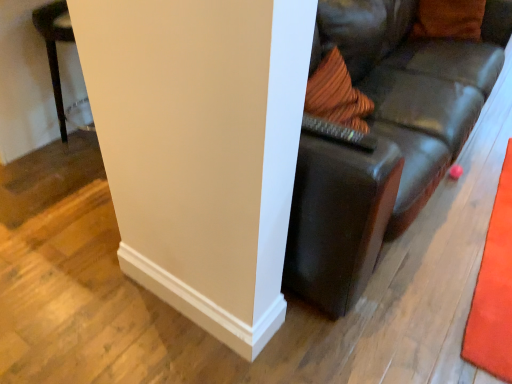
Locate an element on the screen. The width and height of the screenshot is (512, 384). leather couch at center is located at coordinates (383, 140).

The image size is (512, 384). Find the location of `orange fabric pillow at upper right`. orange fabric pillow at upper right is located at coordinates (449, 19).

Considering the positions of objects orange carpet at right and white smooth wall at center in the image provided, who is in front, orange carpet at right or white smooth wall at center?

white smooth wall at center is more forward.

Is orange carpet at right in contact with white smooth wall at center?

orange carpet at right and white smooth wall at center are not in contact.

Can you confirm if orange carpet at right is positioned to the left of white smooth wall at center?

In fact, orange carpet at right is to the right of white smooth wall at center.

Which is closer to the camera, [252,44] or [421,20]?

The point [252,44] is closer.

Does white smooth wall at center lie behind orange fabric pillow at upper right?

No.

From the image's perspective, which is below, white smooth wall at center or orange fabric pillow at upper right?

white smooth wall at center is shown below in the image.

Can you tell me how much white smooth wall at center and orange fabric pillow at upper right differ in facing direction?

2.74 degrees.

From the image's perspective, is orange fabric pillow at upper right on orange carpet at right?

Correct, orange fabric pillow at upper right appears higher than orange carpet at right in the image.

Considering the relative positions of orange fabric pillow at upper right and orange carpet at right in the image provided, is orange fabric pillow at upper right to the right of orange carpet at right from the viewer's perspective?

No, orange fabric pillow at upper right is not to the right of orange carpet at right.

Could you tell me if orange fabric pillow at upper right is turned towards orange carpet at right?

No, orange fabric pillow at upper right is not turned towards orange carpet at right.

Locate an element on the screen. This screenshot has height=384, width=512. pillow behind the orange carpet at right is located at coordinates (449, 19).

Is leather couch at center situated inside white smooth wall at center or outside?

leather couch at center is outside white smooth wall at center.

Is point (386, 45) positioned in front of point (135, 14)?

No, (386, 45) is behind (135, 14).

Who is shorter, leather couch at center or white smooth wall at center?

white smooth wall at center.

Would you say orange carpet at right contains leather couch at center?

No, orange carpet at right does not contain leather couch at center.

From a real-world perspective, is orange carpet at right under leather couch at center?

No, from a real-world perspective, orange carpet at right is not under leather couch at center.

How different are the orientations of orange carpet at right and leather couch at center in degrees?

The angle between the facing direction of orange carpet at right and the facing direction of leather couch at center is 87.1 degrees.

Is point (472, 300) behind point (298, 182)?

Yes, point (472, 300) is farther from viewer.

Where is `pillar in front of the orange carpet at right`? The width and height of the screenshot is (512, 384). pillar in front of the orange carpet at right is located at coordinates (185, 150).

Considering the sizes of white smooth wall at center and orange carpet at right in the image, is white smooth wall at center bigger or smaller than orange carpet at right?

In the image, white smooth wall at center appears to be larger than orange carpet at right.

Is white smooth wall at center located outside orange carpet at right?

white smooth wall at center lies outside orange carpet at right's area.

Is white smooth wall at center not close to orange carpet at right?

Indeed, white smooth wall at center is not near orange carpet at right.

Can you confirm if leather couch at center is shorter than orange carpet at right?

No.

Would you say leather couch at center is a long distance from orange carpet at right?

Actually, leather couch at center and orange carpet at right are a little close together.

Where is `pillar that is under the orange carpet at right (from a real-world perspective)`? The width and height of the screenshot is (512, 384). pillar that is under the orange carpet at right (from a real-world perspective) is located at coordinates (185, 150).

Identify the location of pillar located below the orange fabric pillow at upper right (from the image's perspective). (185, 150).

Looking at the image, which one is located closer to orange carpet at right, white smooth wall at center or leather couch at center?

leather couch at center lies closer to orange carpet at right than the other object.

Looking at the image, which one is located closer to orange fabric pillow at upper right, white smooth wall at center or leather couch at center?

The object closer to orange fabric pillow at upper right is leather couch at center.

From the image, which object appears to be nearer to white smooth wall at center, orange fabric pillow at upper right or orange carpet at right?

orange carpet at right lies closer to white smooth wall at center than the other object.

Which object lies further to the anchor point white smooth wall at center, orange carpet at right or leather couch at center?

Based on the image, orange carpet at right appears to be further to white smooth wall at center.

Estimate the real-world distances between objects in this image. Which object is closer to orange carpet at right, orange fabric pillow at upper right or leather couch at center?

leather couch at center.

Looking at the image, which one is located closer to leather couch at center, white smooth wall at center or orange fabric pillow at upper right?

Based on the image, orange fabric pillow at upper right appears to be nearer to leather couch at center.

Which object lies further to the anchor point orange fabric pillow at upper right, white smooth wall at center or orange carpet at right?

Based on the image, white smooth wall at center appears to be further to orange fabric pillow at upper right.

Considering their positions, is orange fabric pillow at upper right positioned closer to leather couch at center than white smooth wall at center?

The object closer to leather couch at center is orange fabric pillow at upper right.

Locate an element on the screen. pillow between white smooth wall at center and orange carpet at right from left to right is located at coordinates (449, 19).

Where is `mat located between leather couch at center and orange fabric pillow at upper right in the depth direction`? mat located between leather couch at center and orange fabric pillow at upper right in the depth direction is located at coordinates (494, 289).

Find the location of `mat located between white smooth wall at center and leather couch at center in the left-right direction`. mat located between white smooth wall at center and leather couch at center in the left-right direction is located at coordinates (494, 289).

Locate an element on the screen. The height and width of the screenshot is (384, 512). pillow located between white smooth wall at center and leather couch at center in the left-right direction is located at coordinates (449, 19).